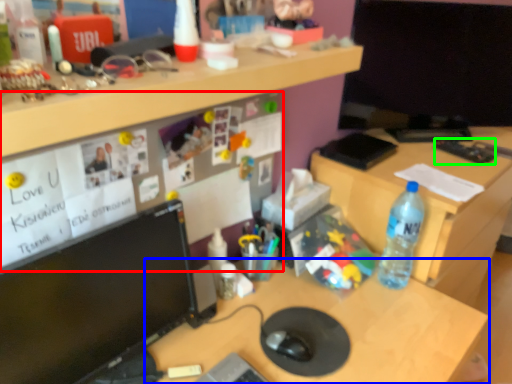
Question: Based on their relative distances, which object is farther from bulletin board (highlighted by a red box)? Choose from desk (highlighted by a blue box) and stationery (highlighted by a green box).

Choices:
 (A) desk
 (B) stationery

Answer: (B)